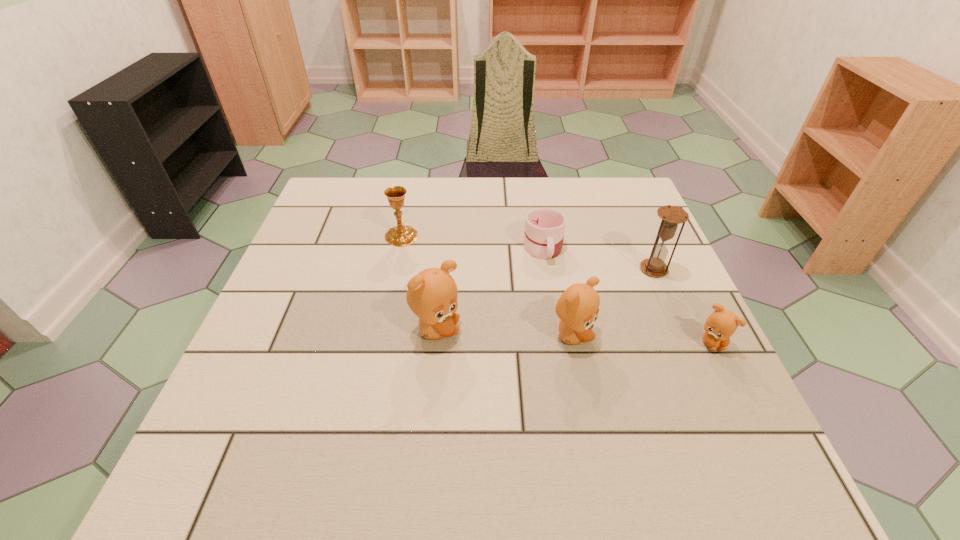
Find the location of `the fifth object from right to left`. the fifth object from right to left is located at coordinates (432, 294).

Locate an element on the screen. The width and height of the screenshot is (960, 540). the second tallest teddy bear is located at coordinates (577, 308).

You are a GUI agent. You are given a task and a screenshot of the screen. Output one action in this format:
    pyautogui.click(x=<x>, y=<y>)
    Task: Click on the fifth tallest object
    The width and height of the screenshot is (960, 540).
    Given the screenshot: What is the action you would take?
    pyautogui.click(x=722, y=323)

Identify the location of the rightmost teddy bear. (722, 323).

I want to click on hourglass, so click(x=672, y=216).

Find the location of `the shortest object`. the shortest object is located at coordinates (544, 232).

You are a GUI agent. You are given a task and a screenshot of the screen. Output one action in this format:
    pyautogui.click(x=<x>, y=<y>)
    Task: Click on the chalice
    Image resolution: width=960 pixels, height=540 pixels.
    Given the screenshot: What is the action you would take?
    pyautogui.click(x=402, y=235)

What are the coordinates of `free space located on the face of the second object from left to right` in the screenshot? It's located at click(x=531, y=330).

Where is `free space located 0.120m on the face of the second teddy bear from left to right`? The height and width of the screenshot is (540, 960). free space located 0.120m on the face of the second teddy bear from left to right is located at coordinates (650, 336).

This screenshot has height=540, width=960. I want to click on free space located 0.080m on the face of the shortest teddy bear, so click(x=733, y=388).